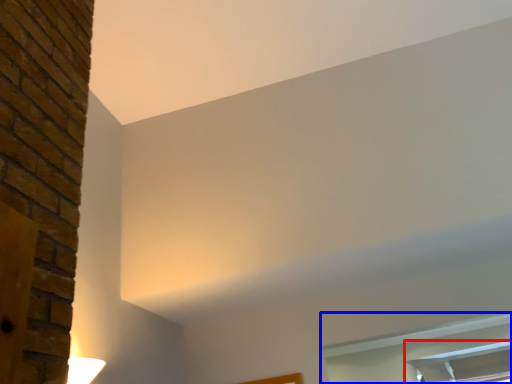
Question: Which object appears closest to the camera in this image, window (highlighted by a red box) or window (highlighted by a blue box)?

Choices:
 (A) window
 (B) window

Answer: (B)